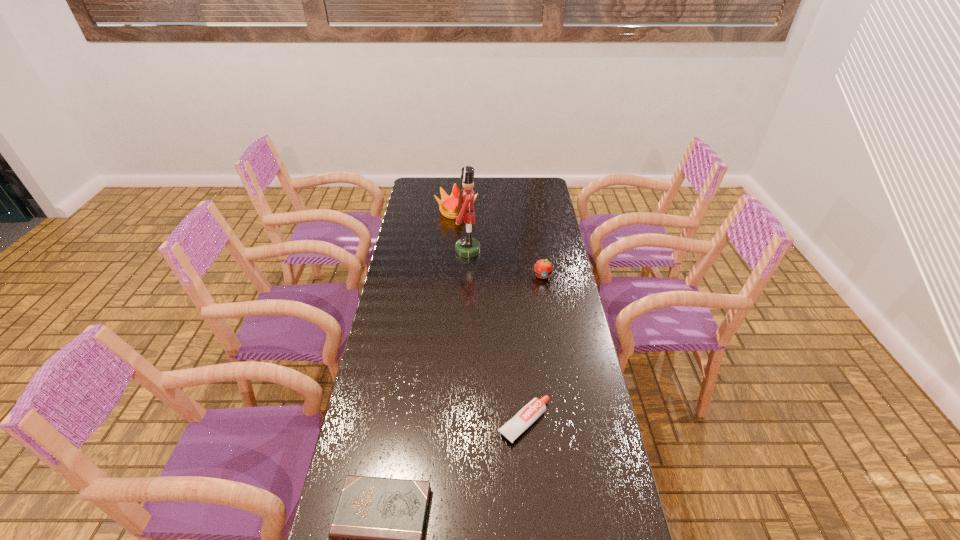
You are a GUI agent. You are given a task and a screenshot of the screen. Output one action in this format:
    pyautogui.click(x=<x>, y=<y>)
    Task: Click on the free region located 0.150m on the front of the third farthest object
    This screenshot has width=960, height=540.
    Given the screenshot: What is the action you would take?
    pyautogui.click(x=547, y=308)

Locate an element on the screen. vacant space located 0.120m on the left of the second nearest object is located at coordinates (457, 422).

Locate an element on the screen. The image size is (960, 540). object present at the far edge is located at coordinates (448, 205).

At what (x,y) coordinates should I click in order to perform the action: click on object that is at the left edge. Please return your answer as a coordinate pair (x, y). This screenshot has height=540, width=960. Looking at the image, I should click on (448, 205).

Locate an element on the screen. The image size is (960, 540). apple that is positioned at the right edge is located at coordinates pyautogui.click(x=543, y=268).

This screenshot has height=540, width=960. Identify the location of toothpaste located at the right edge. (534, 409).

Locate an element on the screen. object located in the far left corner section of the desktop is located at coordinates (448, 205).

In the image, there is a desktop. Where is `free space at the far edge`? Image resolution: width=960 pixels, height=540 pixels. free space at the far edge is located at coordinates (504, 188).

In the image, there is a desktop. Identify the location of vacant space at the left edge. (425, 216).

Where is `vacant space at the right edge`? vacant space at the right edge is located at coordinates (533, 274).